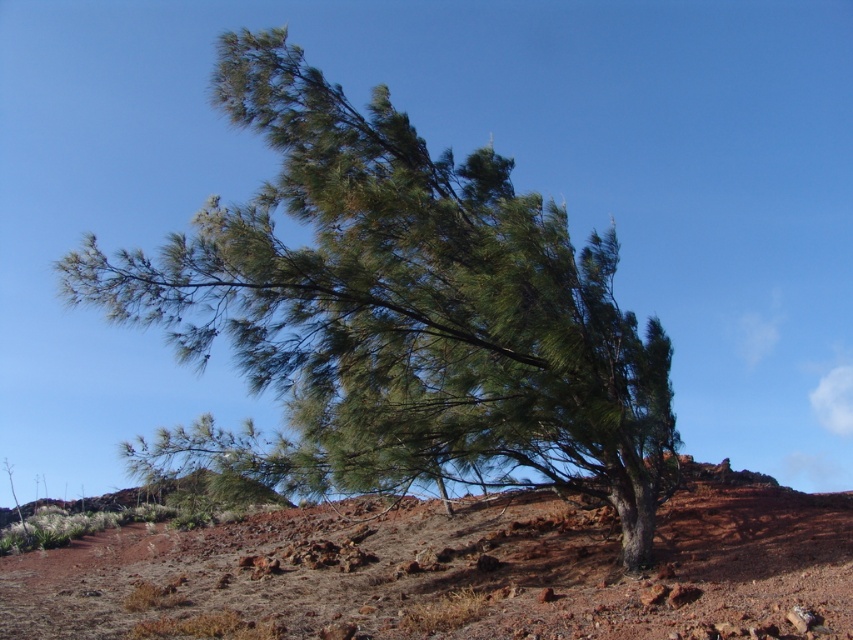
Question: Does green needle-like leaves at center appear under dried grass at center?

Choices:
 (A) no
 (B) yes

Answer: (A)

Question: Observing the image, what is the correct spatial positioning of green needle-like leaves at center in reference to dried grass at center?

Choices:
 (A) right
 (B) left

Answer: (A)

Question: Which point appears closest to the camera in this image?

Choices:
 (A) (175, 237)
 (B) (421, 588)

Answer: (A)

Question: Which object appears farthest from the camera in this image?

Choices:
 (A) green needle-like leaves at center
 (B) dried grass at center

Answer: (A)

Question: Does green needle-like leaves at center lie behind dried grass at center?

Choices:
 (A) yes
 (B) no

Answer: (A)

Question: Which of the following is the farthest from the observer?

Choices:
 (A) (294, 122)
 (B) (166, 550)

Answer: (B)